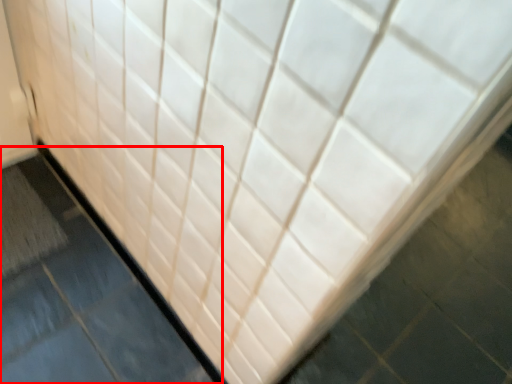
Question: Considering the relative positions of slate (annotated by the red box) and bath mat in the image provided, where is slate (annotated by the red box) located with respect to the staircase?

Choices:
 (A) right
 (B) left

Answer: (A)